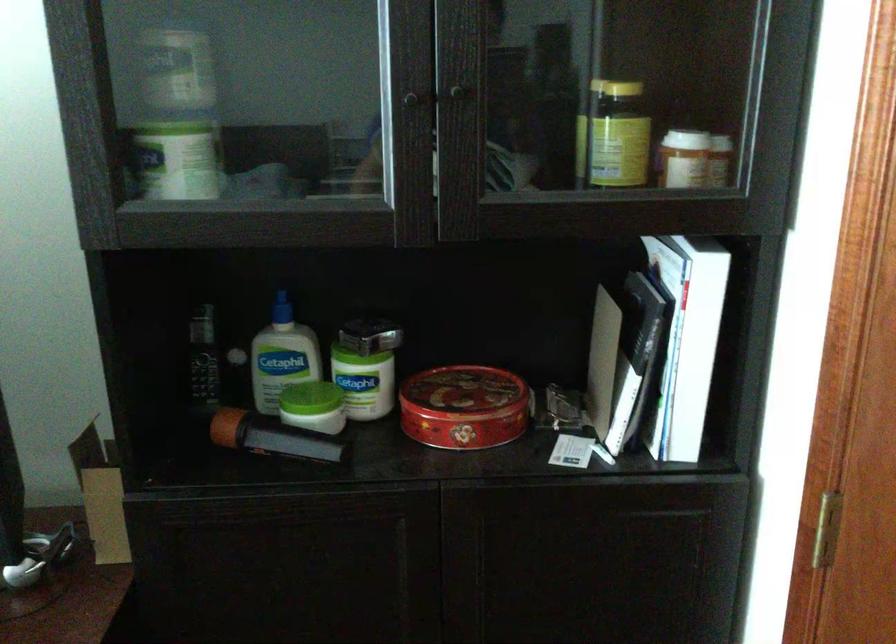
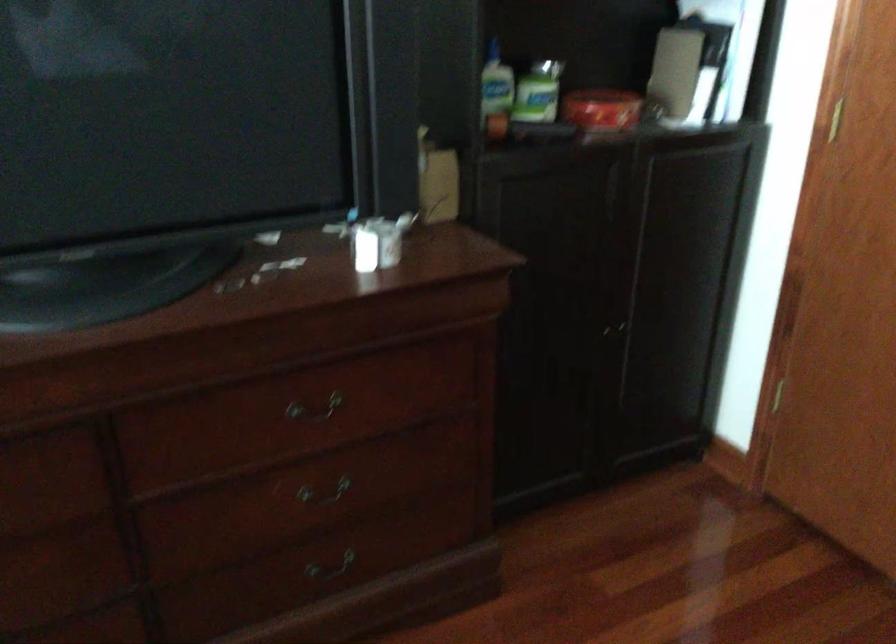
The point at (x=433, y=419) is marked in the first image. Where is the corresponding point in the second image?

(600, 109)